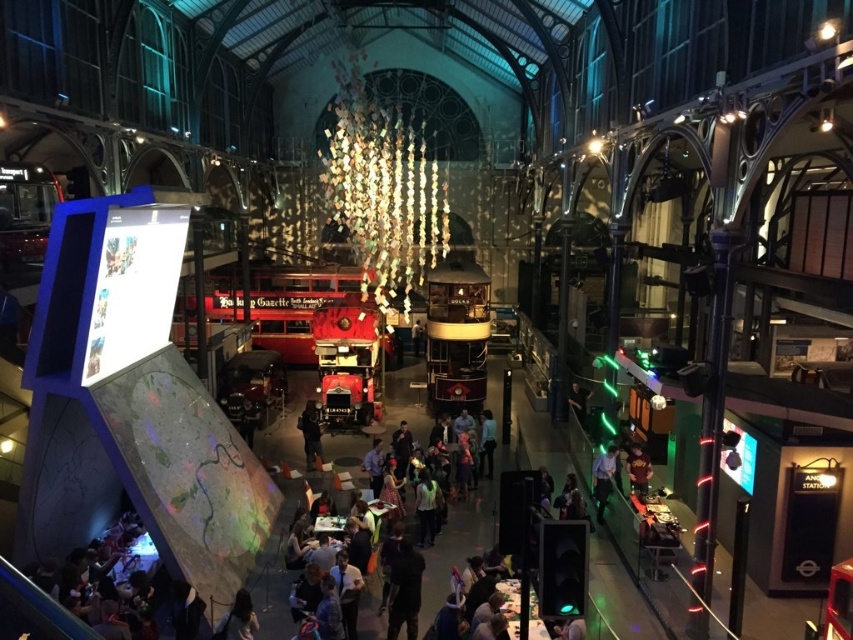
Question: Based on their relative distances, which object is farther from the dark blue shirt at center?

Choices:
 (A) light blue fabric shirt at center
 (B) dark brown leather jacket at lower right

Answer: (A)

Question: Does dark blue shirt at center appear on the right side of dark blue jeans at center?

Choices:
 (A) no
 (B) yes

Answer: (B)

Question: Which object appears farthest from the camera in this image?

Choices:
 (A) dark brown leather jacket at lower right
 (B) black matte jacket at center
 (C) dark blue shirt at center

Answer: (B)

Question: Which is nearer to the dark blue shirt at center?

Choices:
 (A) black matte jacket at center
 (B) light blue fabric shirt at center

Answer: (B)

Question: Can you confirm if light blue fabric shirt at center is thinner than black matte jacket at center?

Choices:
 (A) yes
 (B) no

Answer: (A)

Question: Does black matte jacket at center come behind dark blue jeans at center?

Choices:
 (A) no
 (B) yes

Answer: (B)